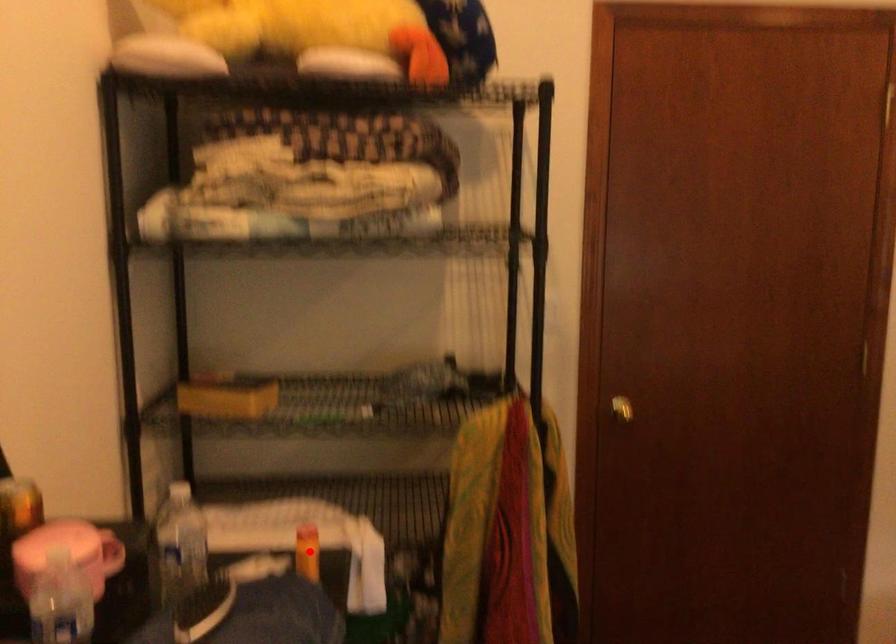
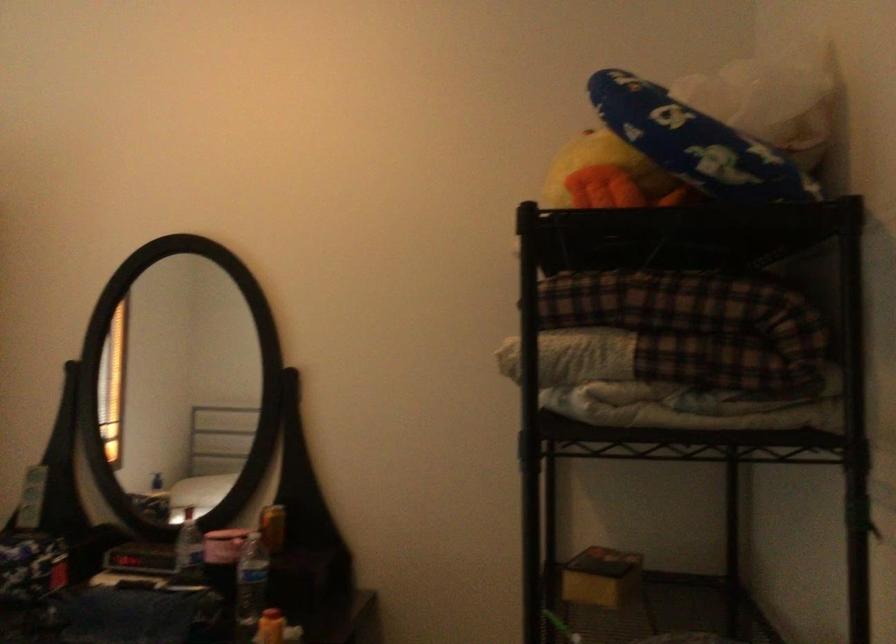
Find the pixel in the second image that matches the highlighted location in the first image.

(270, 627)